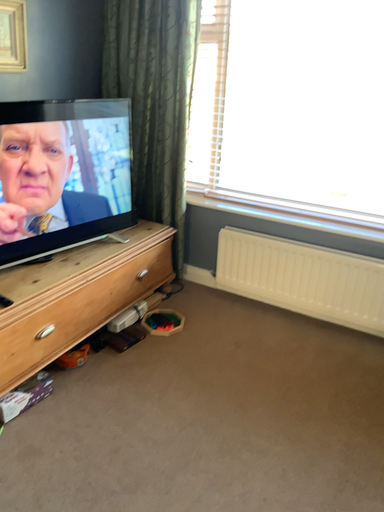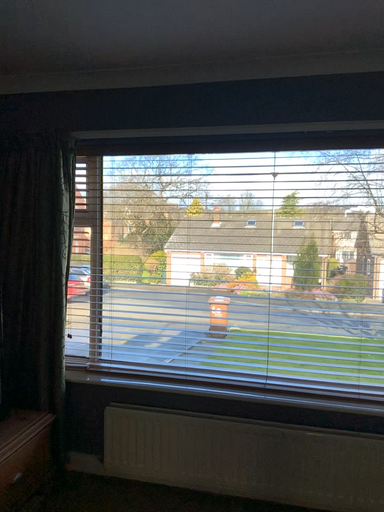
Question: How did the camera likely rotate when shooting the video?

Choices:
 (A) rotated right
 (B) rotated left

Answer: (A)